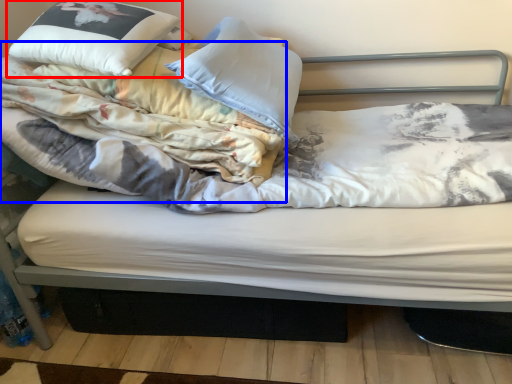
Question: Which point is further to the camera, pillow (highlighted by a red box) or blanket (highlighted by a blue box)?

Choices:
 (A) pillow
 (B) blanket

Answer: (A)